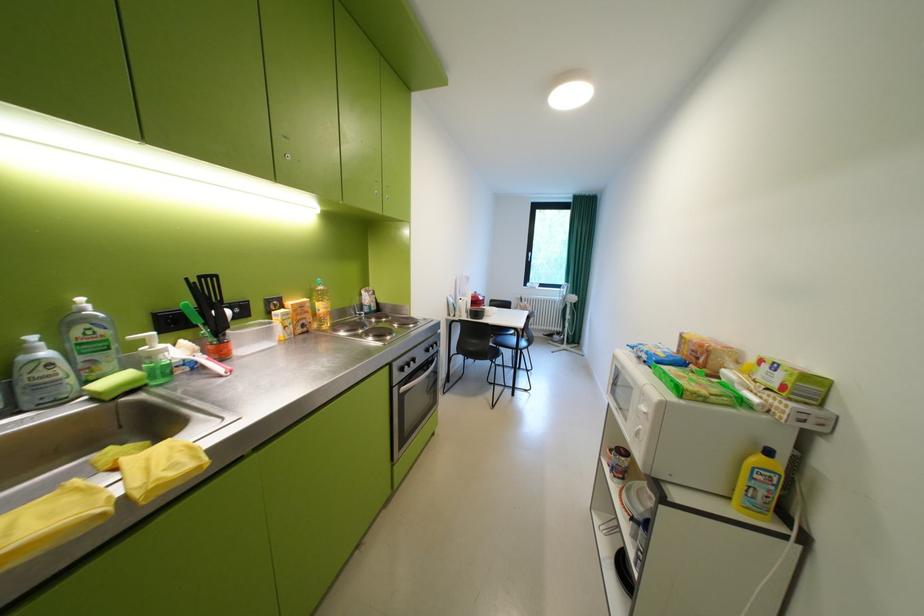
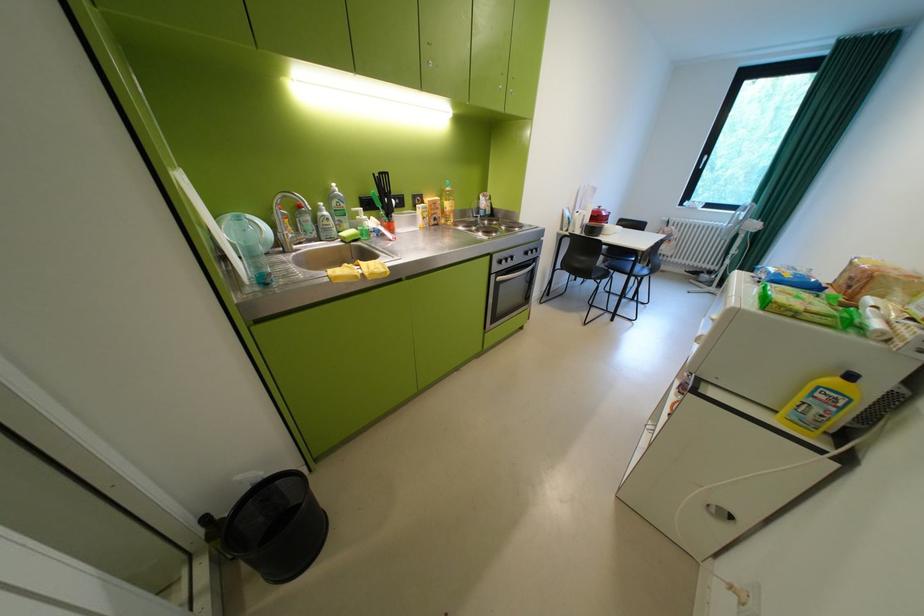
In the second image, find the point that corresponds to pixel 511 339 in the first image.

(626, 264)